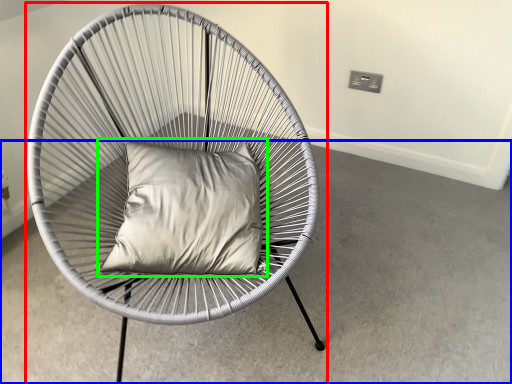
Question: Which is nearer to the chair (highlighted by a red box)? concrete (highlighted by a blue box) or pillow (highlighted by a green box).

Choices:
 (A) concrete
 (B) pillow

Answer: (B)